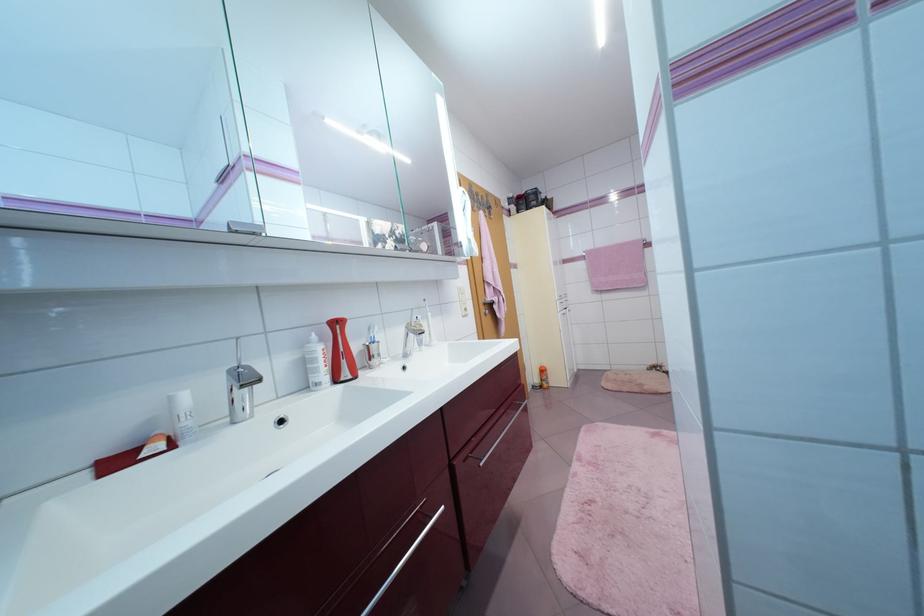
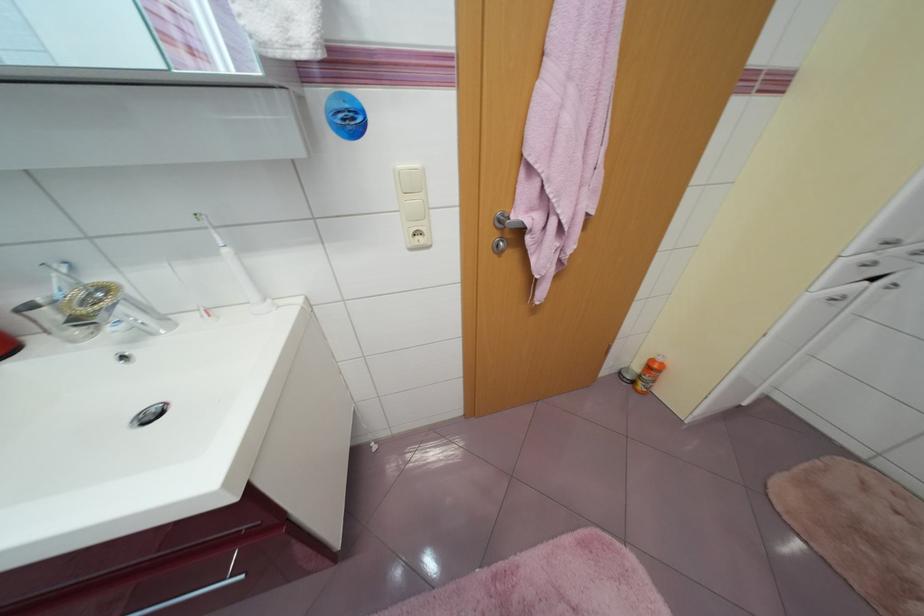
In the second image, find the point that corresponds to point (546, 387) in the first image.

(638, 383)